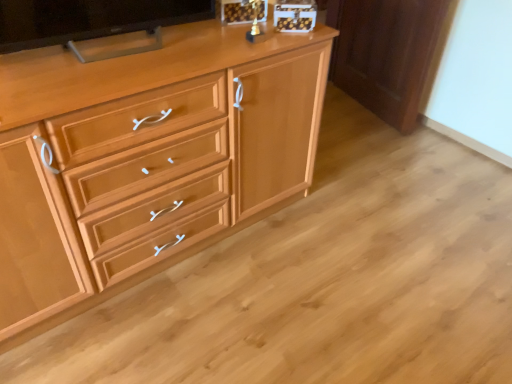
Identify the location of empty space that is to the right of light wood cabinet at center. The height and width of the screenshot is (384, 512). (359, 244).